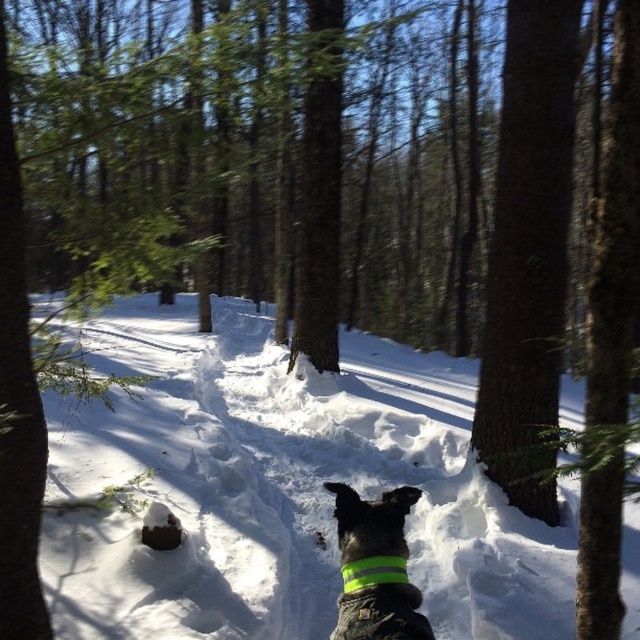
You are a hiker in the forest and see the reflective fabric dog at center and the white fluffy snow at center. Which object is located to the right of the other?

The white fluffy snow at center is positioned on the right side of reflective fabric dog at center.

You are standing on the snow path and see two points marked in the image. The first point is at coordinate point (339,608) and the second is at point (353,582). Which point is closer to you?

Point (339,608) is closer to you because it is further to the viewer than point (353,582).

You are a hiker who just spotted a dog in the forest. You see the dark brown bark at center right and the green reflective band at center. Which object is higher up in the image?

The dark brown bark at center right is located above the green reflective band at center, so it is higher up in the image.